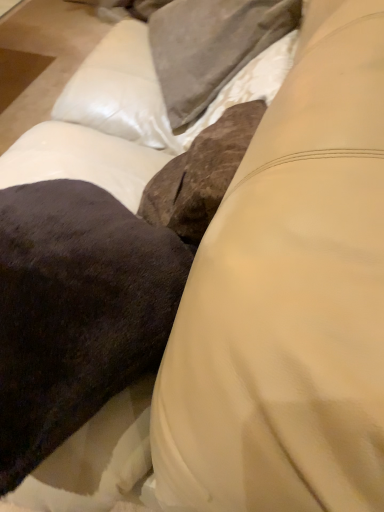
Question: Relative to velvety dark brown pillow at center, is satin gray pillow at upper center in front or behind?

Choices:
 (A) front
 (B) behind

Answer: (B)

Question: Is satin gray pillow at upper center inside or outside of velvety dark brown pillow at center?

Choices:
 (A) inside
 (B) outside

Answer: (B)

Question: Considering the positions of satin gray pillow at upper center and velvety dark brown pillow at center in the image, is satin gray pillow at upper center taller or shorter than velvety dark brown pillow at center?

Choices:
 (A) short
 (B) tall

Answer: (B)

Question: Does point (33, 394) appear closer or farther from the camera than point (170, 12)?

Choices:
 (A) farther
 (B) closer

Answer: (B)

Question: In the image, is velvety dark brown pillow at center positioned in front of or behind satin gray pillow at upper center?

Choices:
 (A) behind
 (B) front

Answer: (B)

Question: Considering the positions of velvety dark brown pillow at center and satin gray pillow at upper center in the image, is velvety dark brown pillow at center wider or thinner than satin gray pillow at upper center?

Choices:
 (A) wide
 (B) thin

Answer: (A)

Question: Considering the positions of velvety dark brown pillow at center and satin gray pillow at upper center in the image, is velvety dark brown pillow at center taller or shorter than satin gray pillow at upper center?

Choices:
 (A) tall
 (B) short

Answer: (B)